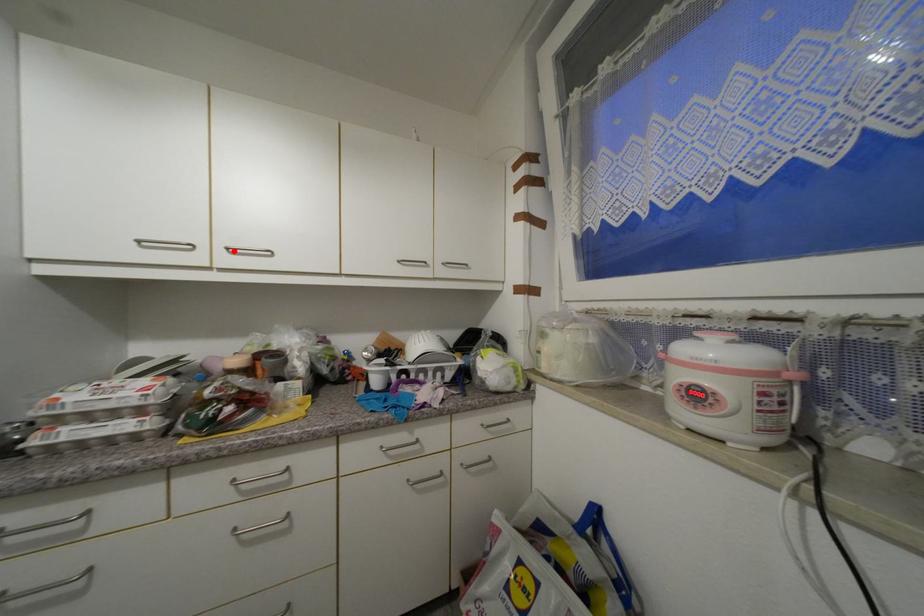
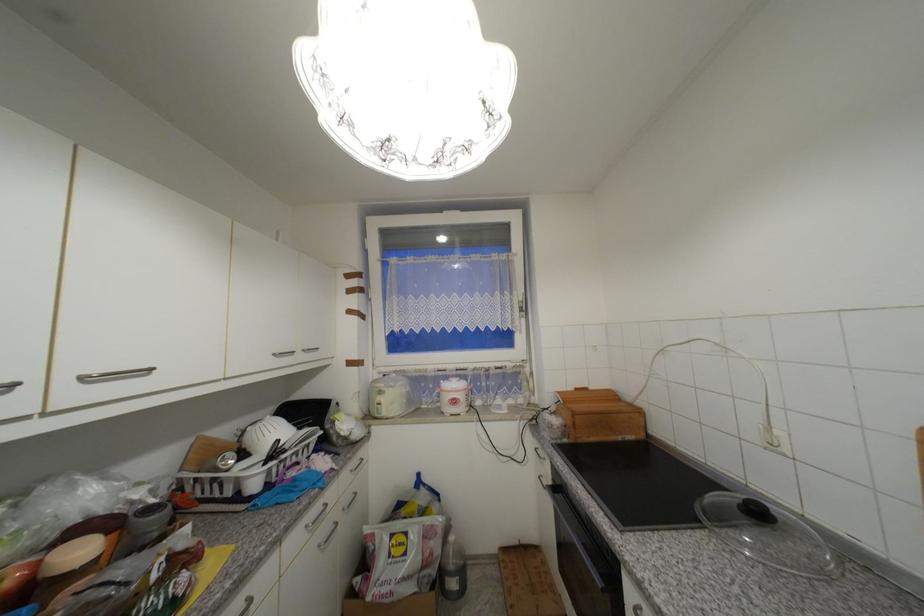
Question: I am providing you with two images of the same scene from different viewpoints. A red point is marked on the first image. Is the red point's position out of view in image 2?

Choices:
 (A) Yes
 (B) No

Answer: (B)